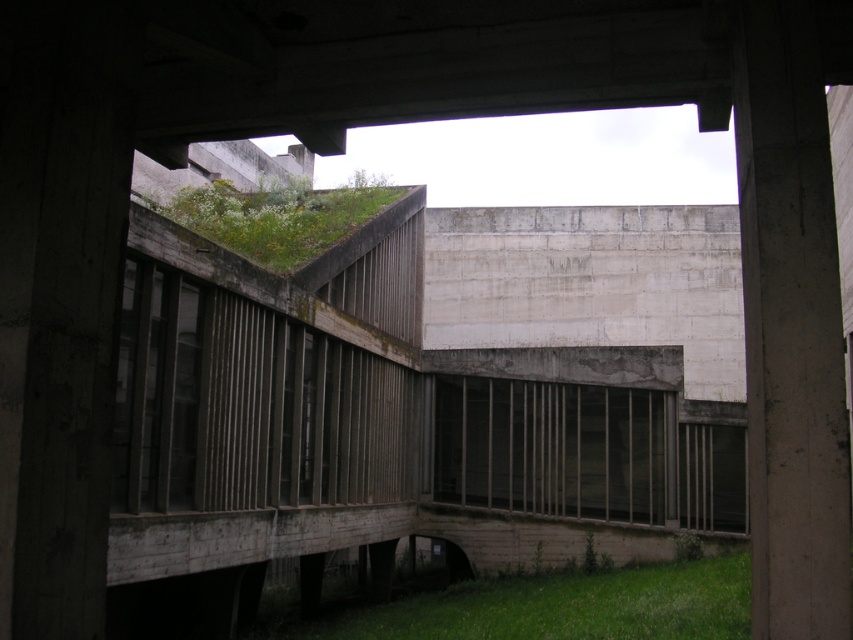
You are an architect designing a new building. You need to place a decorative sculpture between the gray concrete pillar at right and the green mossy roof at upper center. Given their widths, which object should the sculpture be placed closer to?

The gray concrete pillar at right has a smaller width compared to the green mossy roof at upper center, so the sculpture should be placed closer to the gray concrete pillar at right to maintain balance.

From the picture: You are a landscape architect designing a garden around the gray concrete pillar at right and the green grass at lower right. Which object has a smaller width?

The gray concrete pillar at right has a smaller width than the green grass at lower right.

You are planning to install a new pathway in the area. The pathway requires a space wider than the green mossy roof at upper center. Can the green grass at lower right provide enough space for this pathway?

The green grass at lower right has a larger width than the green mossy roof at upper center, so it can provide enough space for the pathway requiring a width larger than the mossy roof.